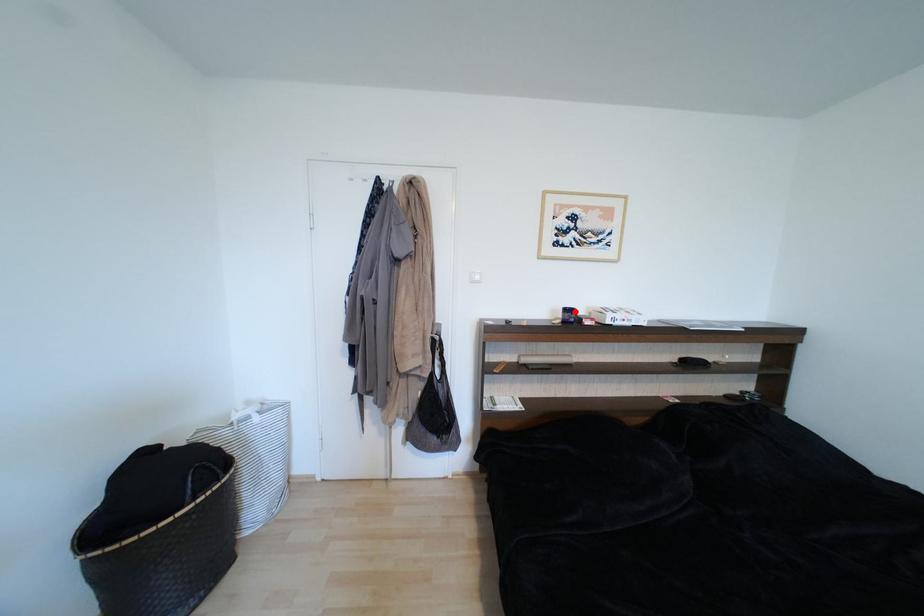
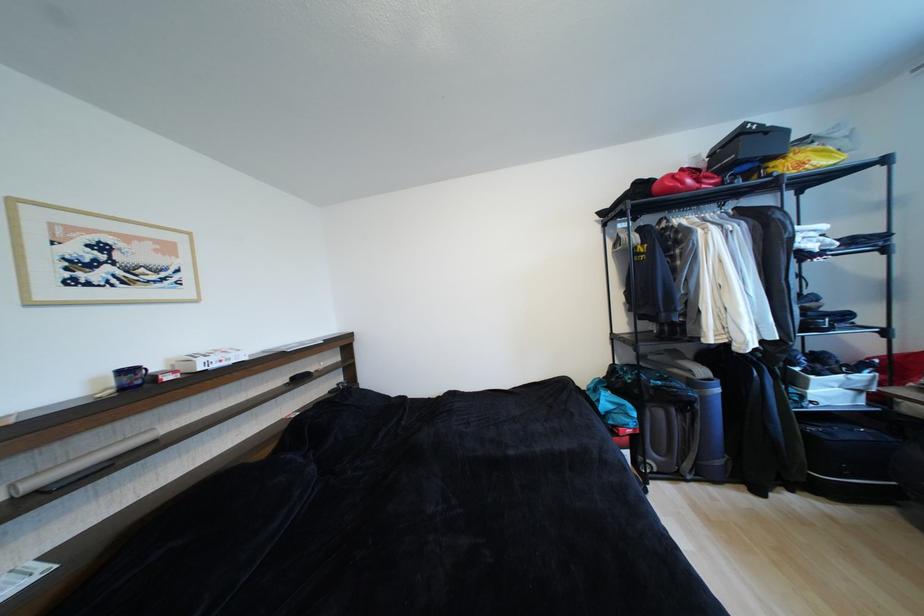
Where in the second image is the point corresponding to the highlighted location from the first image?

(134, 373)